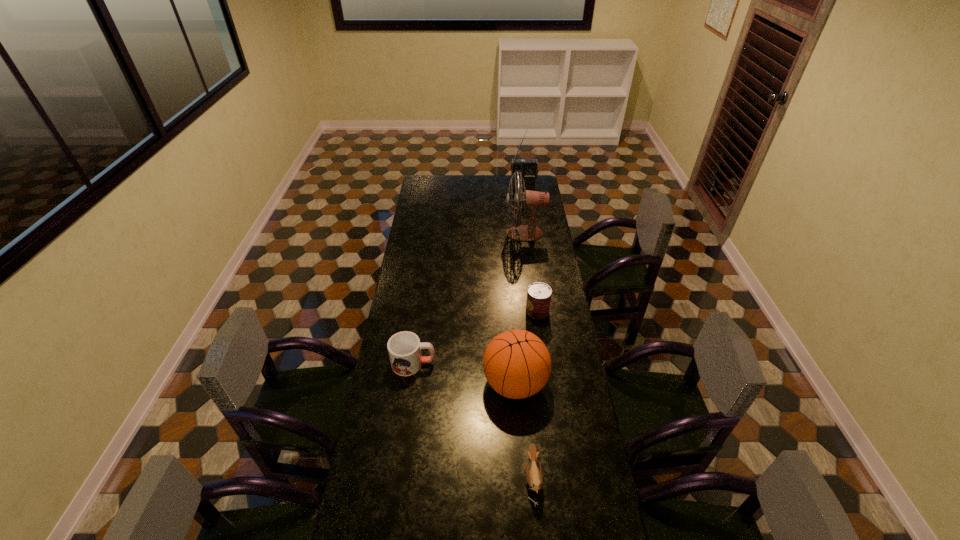
At what (x,y) coordinates should I click in order to perform the action: click on radio receiver. Please return your answer as a coordinate pair (x, y). This screenshot has height=540, width=960. Looking at the image, I should click on (528, 168).

Where is `the second farthest object`? The image size is (960, 540). the second farthest object is located at coordinates point(532,200).

Identify the location of the third tallest object. click(x=517, y=364).

You are a GUI agent. You are given a task and a screenshot of the screen. Output one action in this format:
    pyautogui.click(x=<x>, y=<y>)
    Task: Click on the can
    The height and width of the screenshot is (540, 960).
    Given the screenshot: What is the action you would take?
    pyautogui.click(x=539, y=294)

Find the location of a particular element. the leftmost object is located at coordinates (404, 348).

This screenshot has width=960, height=540. Find the location of `the nearest object`. the nearest object is located at coordinates (534, 477).

The image size is (960, 540). I want to click on the shortest object, so click(534, 477).

I want to click on free location located 0.250m on the display of the farthest object, so click(x=527, y=212).

Find the location of a particular element. This screenshot has width=960, height=540. blank space located in front of the fifth nearest object to direct airflow is located at coordinates (445, 233).

Identify the location of vacant space located 0.160m in front of the fifth nearest object to direct airflow. tap(475, 233).